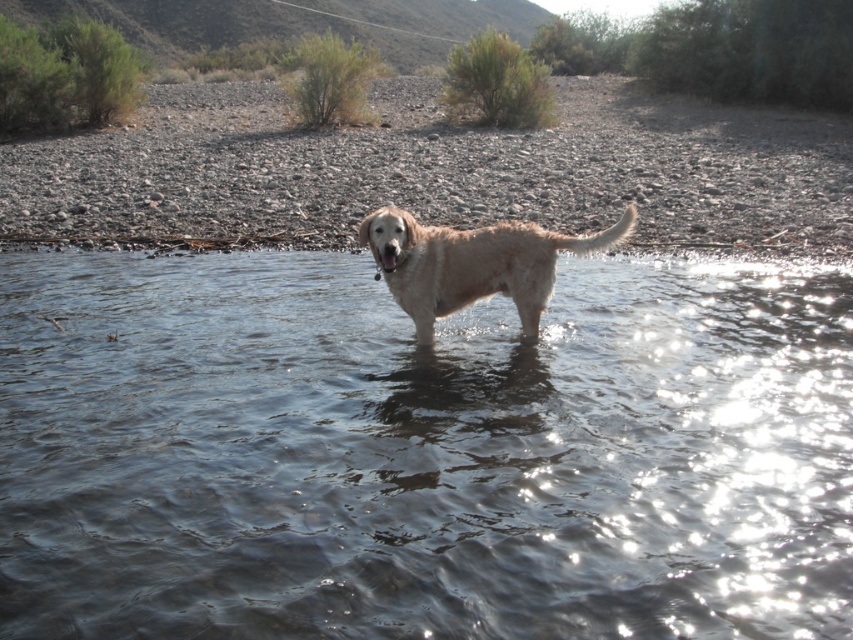
Question: Among these objects, which one is nearest to the camera?

Choices:
 (A) fuzzy golden dog at center
 (B) clear water at center

Answer: (B)

Question: Among these objects, which one is nearest to the camera?

Choices:
 (A) clear water at center
 (B) fuzzy golden dog at center

Answer: (A)

Question: Considering the relative positions of clear water at center and fuzzy golden dog at center in the image provided, where is clear water at center located with respect to fuzzy golden dog at center?

Choices:
 (A) below
 (B) above

Answer: (A)

Question: Which object appears farthest from the camera in this image?

Choices:
 (A) clear water at center
 (B) fuzzy golden dog at center

Answer: (B)

Question: Does clear water at center have a smaller size compared to fuzzy golden dog at center?

Choices:
 (A) yes
 (B) no

Answer: (A)

Question: Is clear water at center to the right of fuzzy golden dog at center from the viewer's perspective?

Choices:
 (A) no
 (B) yes

Answer: (B)